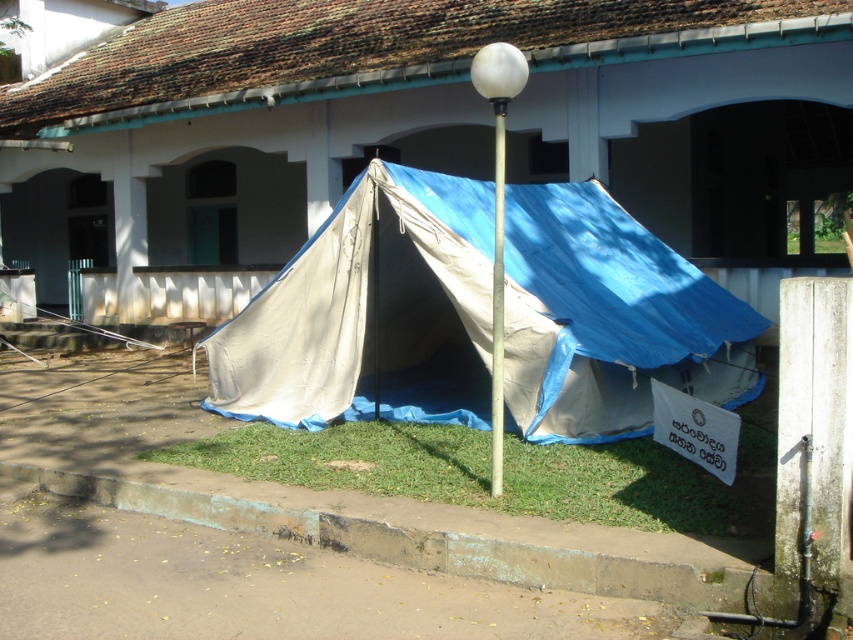
From the picture: Who is taller, blue tarpaulin tent at center or green grass at lower center?

blue tarpaulin tent at center is taller.

Who is more distant from viewer, (227,413) or (549,460)?

The point (227,413) is behind.

Describe the element at coordinates (370, 312) in the screenshot. This screenshot has width=853, height=640. I see `blue tarpaulin tent at center` at that location.

At what (x,y) coordinates should I click in order to perform the action: click on blue tarpaulin tent at center. Please return your answer as a coordinate pair (x, y). Image resolution: width=853 pixels, height=640 pixels. Looking at the image, I should click on (370, 312).

Between blue tarpaulin tent at center and white plastic pole at center, which one is positioned higher?

Positioned higher is white plastic pole at center.

Between blue tarpaulin tent at center and white plastic pole at center, which one is positioned lower?

blue tarpaulin tent at center is below.

Where is `blue tarpaulin tent at center`? The height and width of the screenshot is (640, 853). blue tarpaulin tent at center is located at coordinates (370, 312).

Find the location of `blue tarpaulin tent at center`. blue tarpaulin tent at center is located at coordinates pos(370,312).

Is green grass at lower center wider than white plastic pole at center?

Yes.

Is green grass at lower center further to the viewer compared to white plastic pole at center?

That is False.

Find the location of `green grass at lower center`. green grass at lower center is located at coordinates (505, 472).